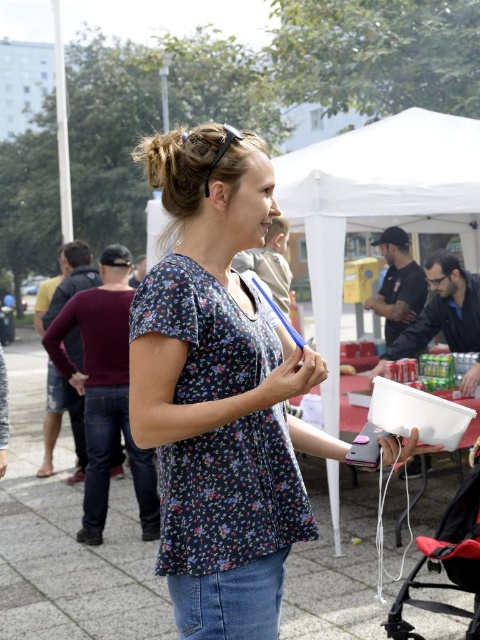
Does white fabric tent at upper center have a greater height compared to red fabric baby carriage at lower right?

Yes.

Between point (355, 180) and point (403, 620), which one is positioned in front?

Point (403, 620) is more forward.

Between point (412, 150) and point (451, 573), which one is positioned behind?

The point (412, 150) is behind.

At what (x,y) coordinates should I click in order to perform the action: click on white fabric tent at upper center. Please return your answer as a coordinate pair (x, y). The height and width of the screenshot is (640, 480). Looking at the image, I should click on (376, 205).

Image resolution: width=480 pixels, height=640 pixels. What do you see at coordinates (218, 392) in the screenshot?
I see `floral fabric blouse at center` at bounding box center [218, 392].

Who is positioned more to the left, floral fabric blouse at center or red fabric baby carriage at lower right?

floral fabric blouse at center is more to the left.

Does point (222, 438) come farther from viewer compared to point (460, 515)?

No, (222, 438) is closer to viewer.

Where is `floral fabric blouse at center`? The width and height of the screenshot is (480, 640). floral fabric blouse at center is located at coordinates (218, 392).

Who is positioned more to the left, floral fabric blouse at center or white fabric tent at upper center?

Positioned to the left is floral fabric blouse at center.

Find the location of a particular element. floral fabric blouse at center is located at coordinates (218, 392).

What are the coordinates of `floral fabric blouse at center` in the screenshot? It's located at (218, 392).